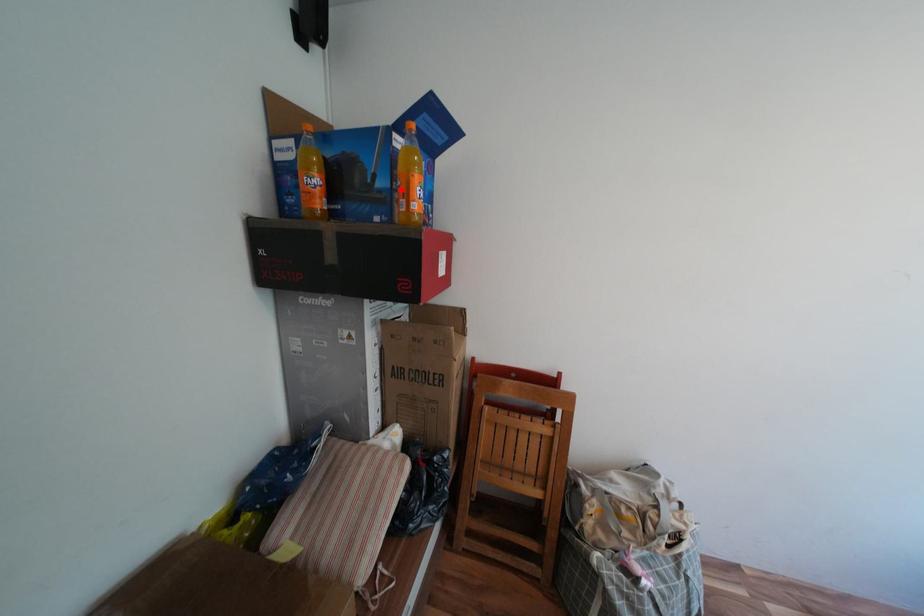
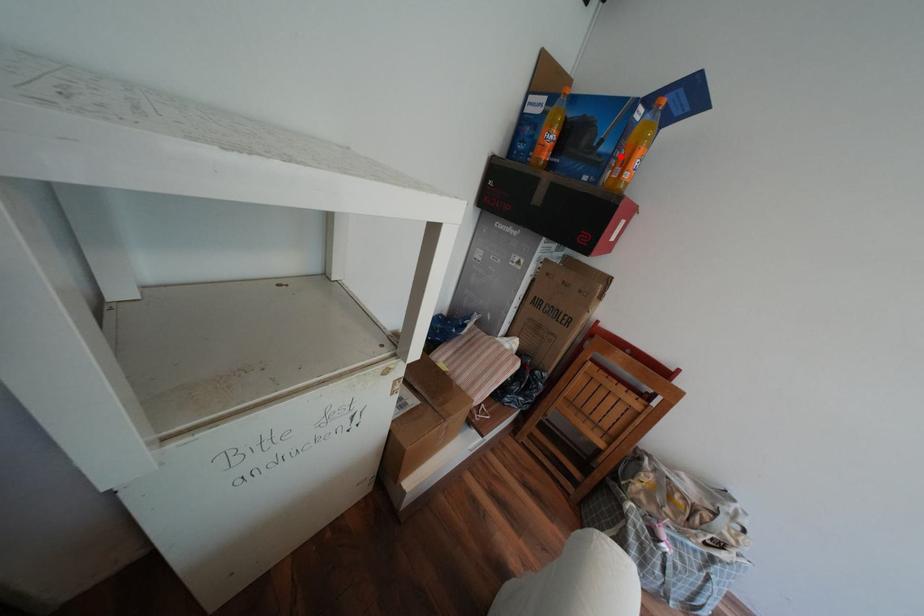
I am providing you with two images of the same scene from different viewpoints. A red point is marked on the first image and another point is marked on the second image. Do the highlighted points in image1 and image2 indicate the same real-world spot?

Yes